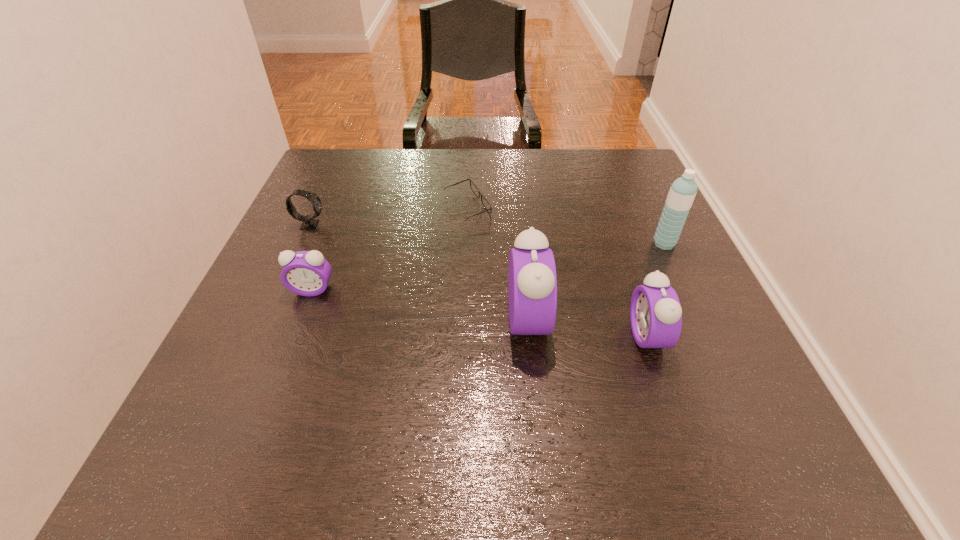
Find the location of `the leftmost alarm clock`. the leftmost alarm clock is located at coordinates (307, 273).

The width and height of the screenshot is (960, 540). I want to click on the fourth object from left to right, so click(x=532, y=283).

The width and height of the screenshot is (960, 540). Find the location of `the second alarm clock from left to right`. the second alarm clock from left to right is located at coordinates (532, 283).

I want to click on the fourth shortest object, so click(655, 313).

Identify the location of the second shortest alarm clock. (655, 313).

The width and height of the screenshot is (960, 540). Find the location of `watch`. watch is located at coordinates (309, 222).

Identify the location of the fourth object from right to left. (487, 206).

The height and width of the screenshot is (540, 960). Identify the location of spectacles. [487, 206].

Where is `the third farthest object`? The width and height of the screenshot is (960, 540). the third farthest object is located at coordinates coord(682,192).

Locate an element on the screen. The width and height of the screenshot is (960, 540). the rightmost object is located at coordinates (682, 192).